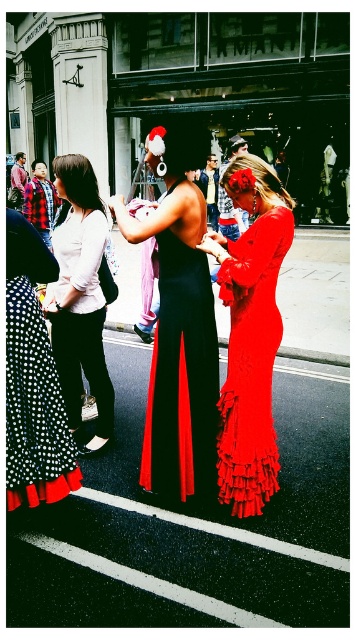
You are a photographer standing in front of the street scene. You notice two points marked at coordinates point (98, 433) and point (27, 410). If you want to focus on the point that is closer to your camera, which coordinate should you choose?

You should choose point (27, 410) because it is closer to the camera than point (98, 433).

You are a fashion designer who needs to choose between two dresses displayed in the store window. The dresses are the matte black dress at center and the black polka dot fabric dress at lower left. Which dress has a bigger size?

The matte black dress at center has a larger size compared to the black polka dot fabric dress at lower left.

You are a photographer standing in front of the two women in the scene. You want to take a photo that focuses on the silky red dress at center without the matte black dress at center blocking it. Based on their positions, is this possible?

The matte black dress at center is closer to the viewer than the silky red dress at center, so the matte black dress at center would block the view of the silky red dress at center. Therefore, it might not be possible to take a photo of the silky red dress at center without the matte black dress at center blocking it unless you move to a different angle or position.